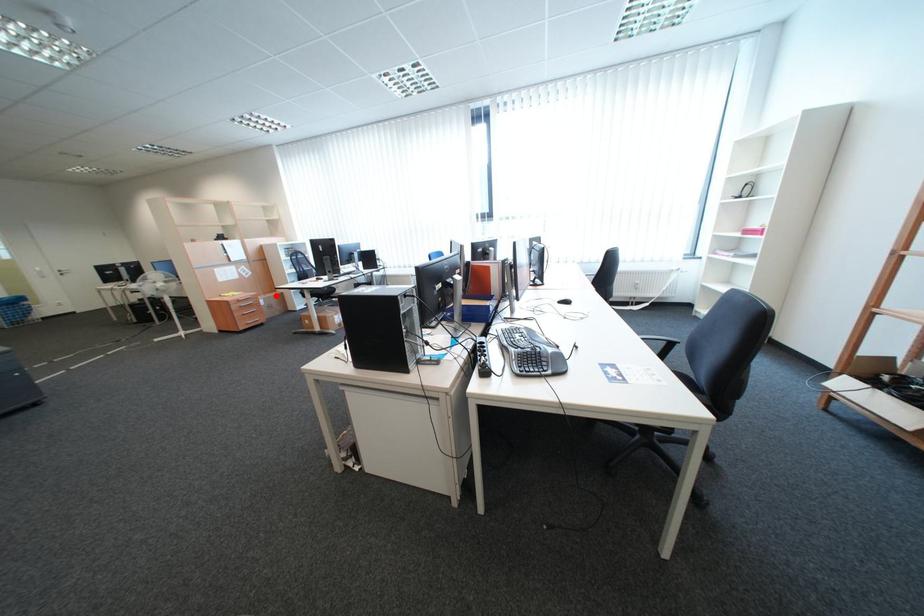
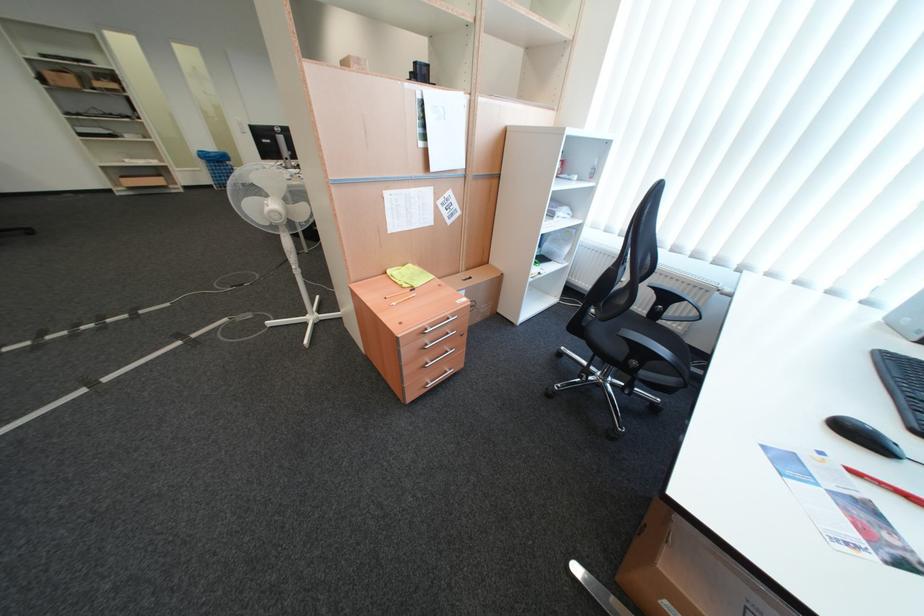
Question: I am providing you with two images of the same scene from different viewpoints. A red point is shown in image1. For the corresponding object point in image2, is it positioned nearer or farther from the camera?

Choices:
 (A) Nearer
 (B) Farther

Answer: (A)